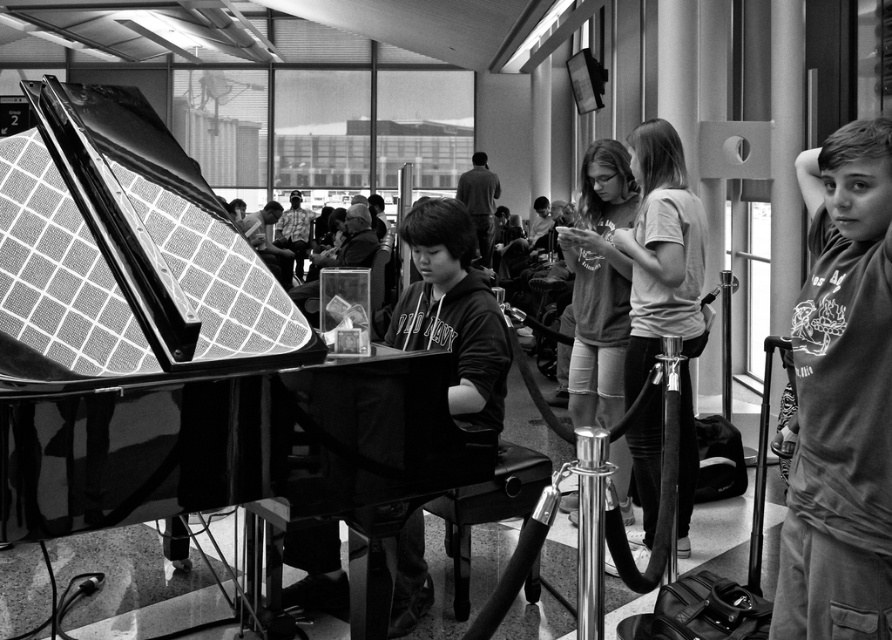
Question: Which point is farther to the camera?

Choices:
 (A) pyautogui.click(x=888, y=458)
 (B) pyautogui.click(x=463, y=289)

Answer: (B)

Question: Can you confirm if smooth gray hoodie at right is positioned above smooth black hoodie at center?

Choices:
 (A) no
 (B) yes

Answer: (A)

Question: Which is nearer to the matte gray shirt at center?

Choices:
 (A) smooth black hoodie at center
 (B) smooth gray hoodie at right

Answer: (A)

Question: Does smooth black hoodie at center have a larger size compared to matte gray shirt at center?

Choices:
 (A) yes
 (B) no

Answer: (B)

Question: Observing the image, what is the correct spatial positioning of smooth black hoodie at center in reference to matte gray shirt at center?

Choices:
 (A) right
 (B) left

Answer: (B)

Question: Which point appears closest to the camera in this image?

Choices:
 (A) (700, 348)
 (B) (339, 609)

Answer: (B)